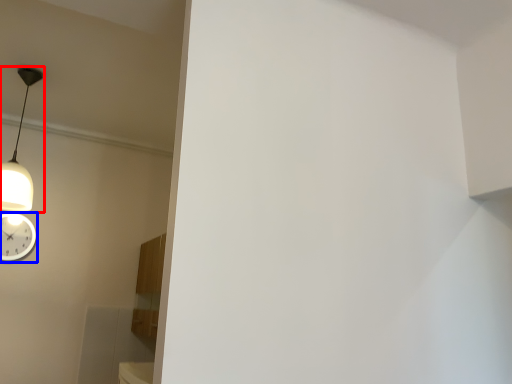
Question: Which object appears farthest to the camera in this image, lamp (highlighted by a red box) or wall clock (highlighted by a blue box)?

Choices:
 (A) lamp
 (B) wall clock

Answer: (B)